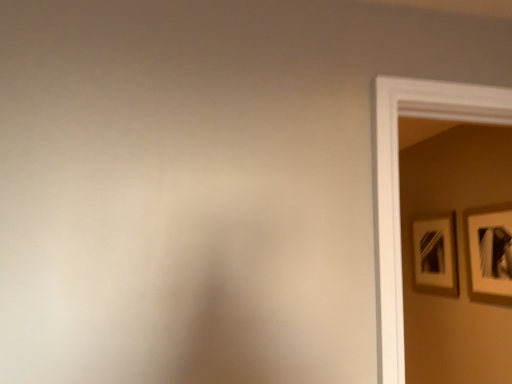
Describe the element at coordinates (436, 255) in the screenshot. I see `white matte picture frame at upper right, placed as the 1th picture frame when sorted from left to right` at that location.

What are the coordinates of `white matte picture frame at upper right, which appears as the 2th picture frame when viewed from the front` in the screenshot? It's located at (436, 255).

Measure the distance between matte white picture frame at right, arranged as the 1th picture frame when viewed from the right, and camera.

A distance of 2.07 meters exists between matte white picture frame at right, arranged as the 1th picture frame when viewed from the right, and camera.

The width and height of the screenshot is (512, 384). Describe the element at coordinates (490, 253) in the screenshot. I see `matte white picture frame at right, which ranks as the second picture frame in left-to-right order` at that location.

How much space does matte white picture frame at right, which ranks as the second picture frame in left-to-right order, occupy horizontally?

The width of matte white picture frame at right, which ranks as the second picture frame in left-to-right order, is 2.11 inches.

Locate an element on the screen. Image resolution: width=512 pixels, height=384 pixels. matte white picture frame at right, arranged as the 1th picture frame when viewed from the right is located at coordinates (490, 253).

The height and width of the screenshot is (384, 512). I want to click on white matte picture frame at upper right, which appears as the 2th picture frame when viewed from the front, so click(x=436, y=255).

Which object is positioned more to the left, white matte picture frame at upper right, placed as the 1th picture frame when sorted from left to right, or matte white picture frame at right, arranged as the 1th picture frame when viewed from the right?

white matte picture frame at upper right, placed as the 1th picture frame when sorted from left to right, is more to the left.

Is the depth of white matte picture frame at upper right, the second picture frame when ordered from right to left, greater than that of matte white picture frame at right, which appears as the second picture frame when viewed from the back?

Yes, it is.

Does point (418, 243) come closer to viewer compared to point (479, 237)?

No, (418, 243) is behind (479, 237).

From the image's perspective, is white matte picture frame at upper right, which appears as the 2th picture frame when viewed from the front, under matte white picture frame at right, arranged as the 1th picture frame when viewed from the right?

Correct, white matte picture frame at upper right, which appears as the 2th picture frame when viewed from the front, appears lower than matte white picture frame at right, arranged as the 1th picture frame when viewed from the right, in the image.

From a real-world perspective, is white matte picture frame at upper right, the second picture frame when ordered from right to left, above or below matte white picture frame at right, arranged as the 1th picture frame when viewed from the right?

In terms of real-world spatial position, white matte picture frame at upper right, the second picture frame when ordered from right to left, is below matte white picture frame at right, arranged as the 1th picture frame when viewed from the right.

Can you confirm if white matte picture frame at upper right, the second picture frame when ordered from right to left, is thinner than matte white picture frame at right, which appears as the second picture frame when viewed from the back?

Correct, the width of white matte picture frame at upper right, the second picture frame when ordered from right to left, is less than that of matte white picture frame at right, which appears as the second picture frame when viewed from the back.

Considering the relative sizes of white matte picture frame at upper right, placed as the 1th picture frame when sorted from left to right, and matte white picture frame at right, which appears as the second picture frame when viewed from the back, in the image provided, is white matte picture frame at upper right, placed as the 1th picture frame when sorted from left to right, taller than matte white picture frame at right, which appears as the second picture frame when viewed from the back,?

No.

Considering the relative sizes of white matte picture frame at upper right, acting as the first picture frame starting from the back, and matte white picture frame at right, arranged as the 1th picture frame when viewed from the right, in the image provided, is white matte picture frame at upper right, acting as the first picture frame starting from the back, bigger than matte white picture frame at right, arranged as the 1th picture frame when viewed from the right,?

Correct, white matte picture frame at upper right, acting as the first picture frame starting from the back, is larger in size than matte white picture frame at right, arranged as the 1th picture frame when viewed from the right.

Is white matte picture frame at upper right, acting as the first picture frame starting from the back, inside or outside of matte white picture frame at right, which appears as the second picture frame when viewed from the back?

white matte picture frame at upper right, acting as the first picture frame starting from the back, is spatially situated outside matte white picture frame at right, which appears as the second picture frame when viewed from the back.

Is white matte picture frame at upper right, acting as the first picture frame starting from the back, next to matte white picture frame at right, arranged as the 1th picture frame when viewed from the right, and touching it?

white matte picture frame at upper right, acting as the first picture frame starting from the back, and matte white picture frame at right, arranged as the 1th picture frame when viewed from the right, are not in contact.

Is white matte picture frame at upper right, acting as the first picture frame starting from the back, positioned with its back to matte white picture frame at right, which ranks as the second picture frame in left-to-right order?

No, white matte picture frame at upper right, acting as the first picture frame starting from the back, is not facing away from matte white picture frame at right, which ranks as the second picture frame in left-to-right order.

Find the location of a particular element. This screenshot has width=512, height=384. picture frame that is above the white matte picture frame at upper right, which appears as the 2th picture frame when viewed from the front (from a real-world perspective) is located at coordinates (490, 253).

Considering the positions of objects matte white picture frame at right, which appears as the second picture frame when viewed from the back, and white matte picture frame at upper right, acting as the first picture frame starting from the back, in the image provided, who is more to the left, matte white picture frame at right, which appears as the second picture frame when viewed from the back, or white matte picture frame at upper right, acting as the first picture frame starting from the back,?

white matte picture frame at upper right, acting as the first picture frame starting from the back.

Considering their positions, is matte white picture frame at right, the 1th picture frame positioned from the front, located in front of or behind white matte picture frame at upper right, placed as the 1th picture frame when sorted from left to right?

matte white picture frame at right, the 1th picture frame positioned from the front, is in front of white matte picture frame at upper right, placed as the 1th picture frame when sorted from left to right.

Between point (495, 288) and point (417, 234), which one is positioned in front?

The point (495, 288) is in front.

From the image's perspective, is matte white picture frame at right, which appears as the second picture frame when viewed from the back, below white matte picture frame at upper right, acting as the first picture frame starting from the back?

No, from the image's perspective, matte white picture frame at right, which appears as the second picture frame when viewed from the back, is not below white matte picture frame at upper right, acting as the first picture frame starting from the back.

Consider the image. From a real-world perspective, is matte white picture frame at right, which appears as the second picture frame when viewed from the back, physically below white matte picture frame at upper right, which appears as the 2th picture frame when viewed from the front?

Incorrect, from a real-world perspective, matte white picture frame at right, which appears as the second picture frame when viewed from the back, is higher than white matte picture frame at upper right, which appears as the 2th picture frame when viewed from the front.

Does matte white picture frame at right, which ranks as the second picture frame in left-to-right order, have a greater width compared to white matte picture frame at upper right, the second picture frame when ordered from right to left?

Correct, the width of matte white picture frame at right, which ranks as the second picture frame in left-to-right order, exceeds that of white matte picture frame at upper right, the second picture frame when ordered from right to left.

Which of these two, matte white picture frame at right, which appears as the second picture frame when viewed from the back, or white matte picture frame at upper right, placed as the 1th picture frame when sorted from left to right, stands shorter?

white matte picture frame at upper right, placed as the 1th picture frame when sorted from left to right.

Looking at the image, does matte white picture frame at right, which appears as the second picture frame when viewed from the back, seem bigger or smaller compared to white matte picture frame at upper right, which appears as the 2th picture frame when viewed from the front?

Considering their sizes, matte white picture frame at right, which appears as the second picture frame when viewed from the back, takes up less space than white matte picture frame at upper right, which appears as the 2th picture frame when viewed from the front.

Would you say matte white picture frame at right, arranged as the 1th picture frame when viewed from the right, contains white matte picture frame at upper right, the second picture frame when ordered from right to left?

That's incorrect, white matte picture frame at upper right, the second picture frame when ordered from right to left, is not inside matte white picture frame at right, arranged as the 1th picture frame when viewed from the right.

Is matte white picture frame at right, which ranks as the second picture frame in left-to-right order, in contact with white matte picture frame at upper right, which appears as the 2th picture frame when viewed from the front?

No, matte white picture frame at right, which ranks as the second picture frame in left-to-right order, is not beside white matte picture frame at upper right, which appears as the 2th picture frame when viewed from the front.

Is matte white picture frame at right, arranged as the 1th picture frame when viewed from the right, positioned with its back to white matte picture frame at upper right, placed as the 1th picture frame when sorted from left to right?

matte white picture frame at right, arranged as the 1th picture frame when viewed from the right, does not have its back to white matte picture frame at upper right, placed as the 1th picture frame when sorted from left to right.

What's the angular difference between matte white picture frame at right, which appears as the second picture frame when viewed from the back, and white matte picture frame at upper right, placed as the 1th picture frame when sorted from left to right,'s facing directions?

0.836 degrees separate the facing orientations of matte white picture frame at right, which appears as the second picture frame when viewed from the back, and white matte picture frame at upper right, placed as the 1th picture frame when sorted from left to right.

The image size is (512, 384). In the image, there is a white matte picture frame at upper right, placed as the 1th picture frame when sorted from left to right. In order to click on picture frame above it (from the image's perspective) in this screenshot , I will do `click(490, 253)`.

In order to click on picture frame in front of the white matte picture frame at upper right, which appears as the 2th picture frame when viewed from the front in this screenshot , I will do `click(490, 253)`.

Identify the location of picture frame on the left side of matte white picture frame at right, arranged as the 1th picture frame when viewed from the right. (436, 255).